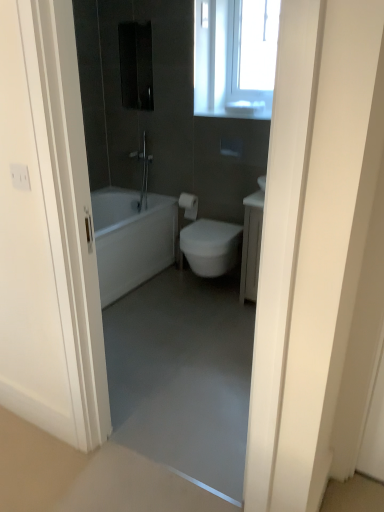
Question: Is matte silver shower at center taller than white glossy bidet at center?

Choices:
 (A) yes
 (B) no

Answer: (A)

Question: Can you confirm if matte silver shower at center is wider than white glossy bidet at center?

Choices:
 (A) no
 (B) yes

Answer: (A)

Question: Is matte silver shower at center outside white glossy bidet at center?

Choices:
 (A) yes
 (B) no

Answer: (A)

Question: From a real-world perspective, is matte silver shower at center located higher than white glossy bidet at center?

Choices:
 (A) no
 (B) yes

Answer: (B)

Question: From the image's perspective, is matte silver shower at center under white glossy bidet at center?

Choices:
 (A) yes
 (B) no

Answer: (B)

Question: Does matte silver shower at center have a lesser width compared to white glossy bidet at center?

Choices:
 (A) yes
 (B) no

Answer: (A)

Question: Considering the relative sizes of white matte toilet paper at center and matte silver shower at center in the image provided, is white matte toilet paper at center taller than matte silver shower at center?

Choices:
 (A) yes
 (B) no

Answer: (B)

Question: Considering the relative sizes of white matte toilet paper at center and matte silver shower at center in the image provided, is white matte toilet paper at center smaller than matte silver shower at center?

Choices:
 (A) yes
 (B) no

Answer: (A)

Question: Is white matte toilet paper at center to the right of matte silver shower at center from the viewer's perspective?

Choices:
 (A) yes
 (B) no

Answer: (A)

Question: Is white matte toilet paper at center not near matte silver shower at center?

Choices:
 (A) yes
 (B) no

Answer: (B)

Question: Is white matte toilet paper at center with matte silver shower at center?

Choices:
 (A) yes
 (B) no

Answer: (B)

Question: Does white matte toilet paper at center appear on the left side of matte silver shower at center?

Choices:
 (A) no
 (B) yes

Answer: (A)

Question: From a real-world perspective, is matte silver shower at center on top of white glossy door at upper center?

Choices:
 (A) yes
 (B) no

Answer: (B)